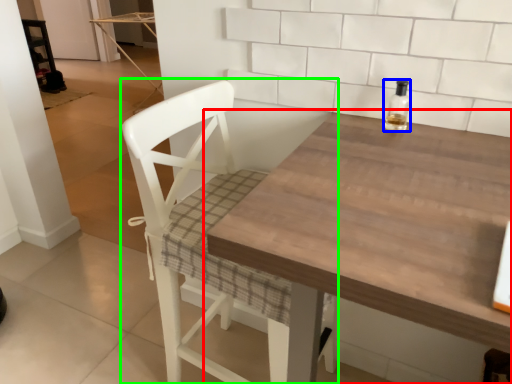
Question: Which is farther away from table (highlighted by a red box)? bottle (highlighted by a blue box) or chair (highlighted by a green box)?

Choices:
 (A) bottle
 (B) chair

Answer: (A)